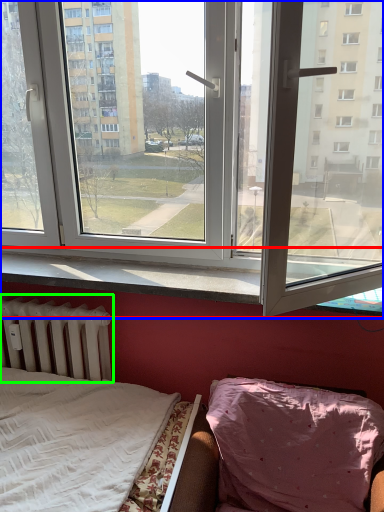
Question: Estimate the real-world distances between objects in this image. Which object is farther from window sill (highlighted by a red box), window (highlighted by a blue box) or radiator (highlighted by a green box)?

Choices:
 (A) window
 (B) radiator

Answer: (A)